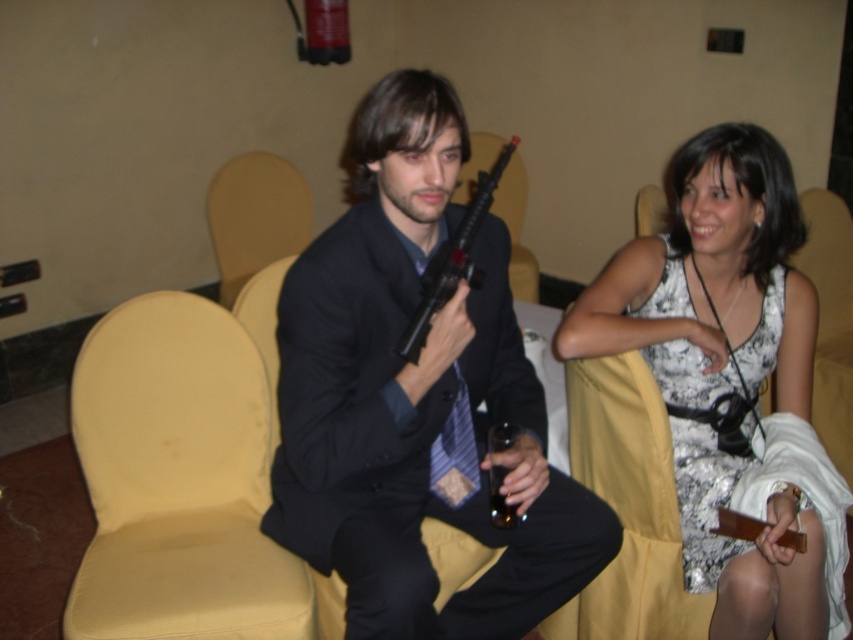
Question: Estimate the real-world distances between objects in this image. Which object is closer to the yellow fabric chair at left?

Choices:
 (A) white floral dress at center
 (B) matte black suit at center
 (C) translucent glass at right
 (D) yellow fabric armchair at center

Answer: (B)

Question: Is white floral dress at center thinner than black plastic gun at center?

Choices:
 (A) yes
 (B) no

Answer: (B)

Question: Can you confirm if white floral dress at center is positioned to the left of yellow fabric chair at left?

Choices:
 (A) yes
 (B) no

Answer: (B)

Question: Which point is closer to the camera?

Choices:
 (A) (587, 355)
 (B) (187, 456)

Answer: (A)

Question: Among these objects, which one is farthest from the camera?

Choices:
 (A) yellow fabric chair at left
 (B) matte black suit at center
 (C) yellow fabric armchair at center

Answer: (C)

Question: Is black plastic gun at center smaller than translucent glass at right?

Choices:
 (A) yes
 (B) no

Answer: (B)